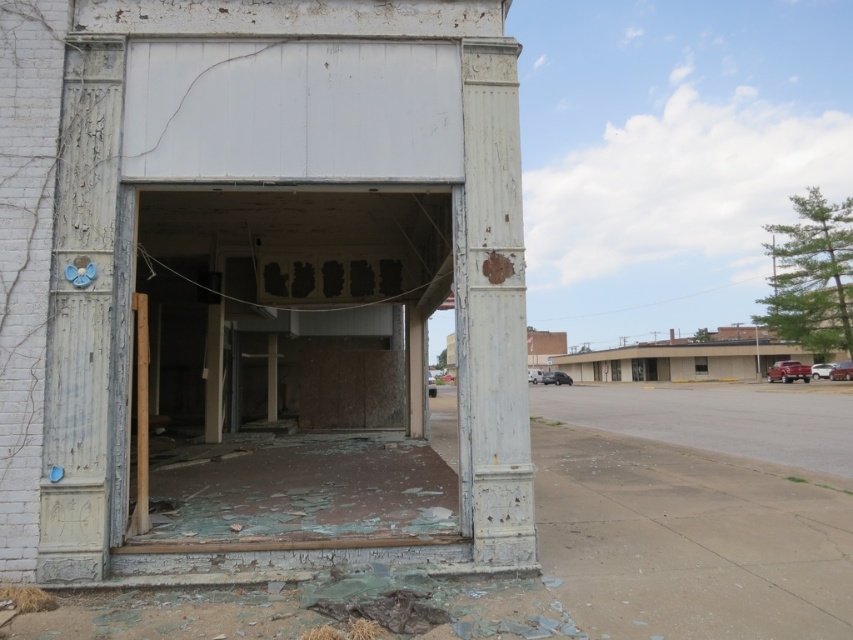
You are a construction worker assessing the safety of this abandoned storefront. You notice the peeling paint garage door at center and the white peeling paint at upper center. Which area should you prioritize inspecting first based on their proximity to the entrance?

The peeling paint garage door at center is closer to the entrance and thus should be inspected first since it is closer to the viewer than the white peeling paint at upper center.

You are a construction worker assessing the damage to the abandoned storefront. You notice the peeling paint garage door at center and the white peeling paint at upper center. Which of these two areas has a larger area of peeling paint?

The peeling paint garage door at center has a larger size compared to the white peeling paint at upper center, so the area with the larger peeling paint is the peeling paint garage door at center.

You are standing in front of the abandoned storefront and notice the peeling paint garage door at center. Can you determine its exact position relative to the entrance?

The peeling paint garage door at center is located at point [288,364], which is at the center of the storefront, directly aligned with the entrance.